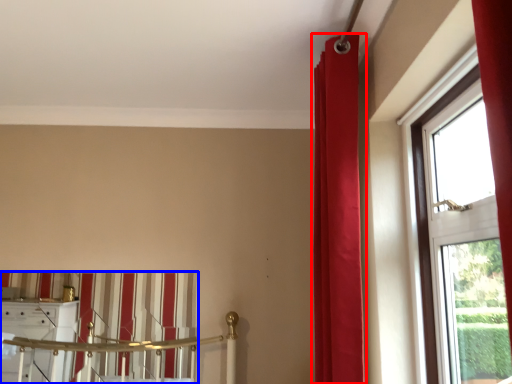
Question: Which object appears closest to the camera in this image, curtain (highlighted by a red box) or curtain (highlighted by a blue box)?

Choices:
 (A) curtain
 (B) curtain

Answer: (A)